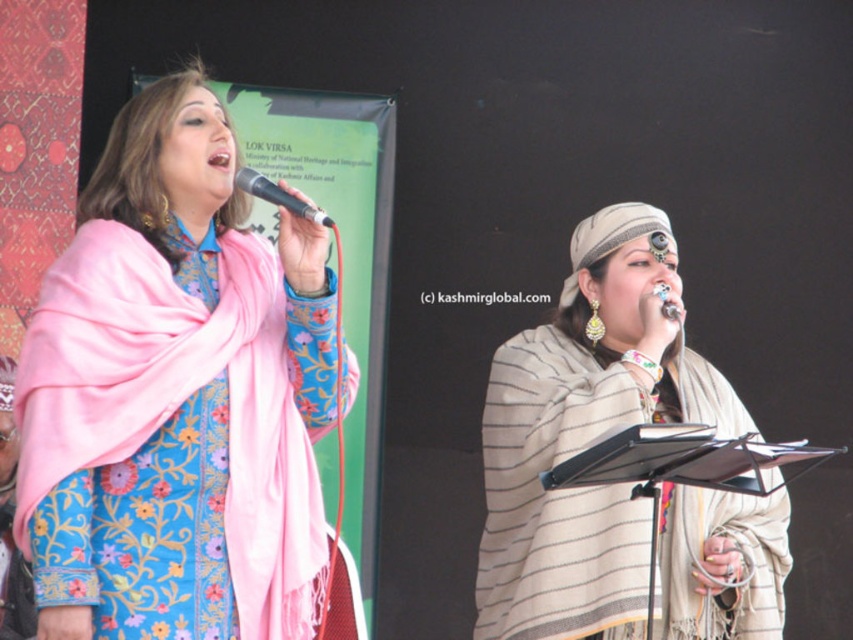
Is point (662, 419) more distant than point (300, 209)?

That is True.

Is beige striped shawl at center smaller than metallic silver microphone at upper center?

No, beige striped shawl at center is not smaller than metallic silver microphone at upper center.

Where is `beige striped shawl at center`? beige striped shawl at center is located at coordinates (585, 435).

Does matte pink scarf at left have a smaller size compared to metallic silver microphone at upper center?

Incorrect, matte pink scarf at left is not smaller in size than metallic silver microphone at upper center.

From the picture: Is matte pink scarf at left in front of metallic silver microphone at upper center?

No, matte pink scarf at left is further to the viewer.

Find the location of `matte pink scarf at left`. matte pink scarf at left is located at coordinates (x=178, y=396).

At what (x,y) coordinates should I click in order to perform the action: click on matte pink scarf at left. Please return your answer as a coordinate pair (x, y). Looking at the image, I should click on (178, 396).

Is matte pink scarf at left to the right of beige striped shawl at center from the viewer's perspective?

Incorrect, matte pink scarf at left is not on the right side of beige striped shawl at center.

Between matte pink scarf at left and beige striped shawl at center, which one has more height?

matte pink scarf at left is taller.

Identify the location of matte pink scarf at left. The height and width of the screenshot is (640, 853). (178, 396).